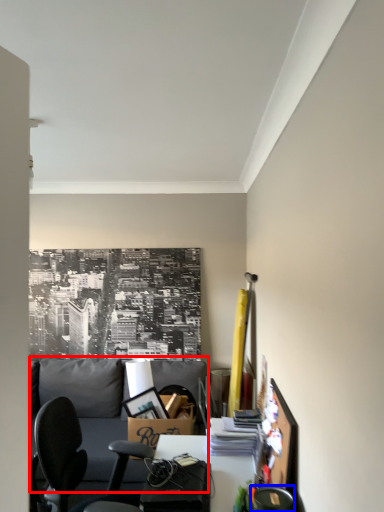
Question: Which of the following is the farthest to the observer, couch (highlighted by a red box) or chair (highlighted by a blue box)?

Choices:
 (A) couch
 (B) chair

Answer: (A)